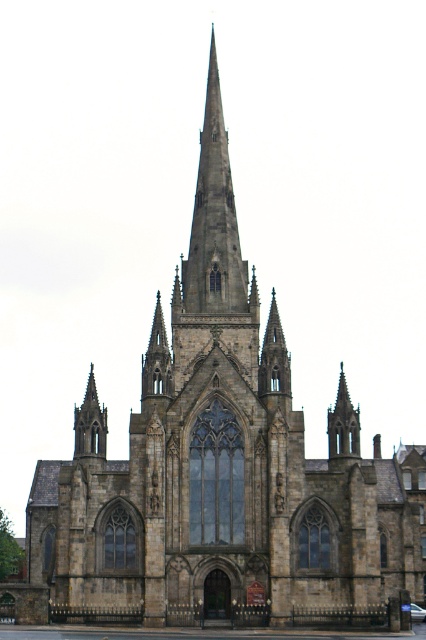
Consider the image. You are standing in front of the church and want to take a photo that captures both the brown stone spire at lower left and the dark brown stone spire at upper center. Which spire should you focus on first to ensure both are in frame?

The brown stone spire at lower left is much taller than the dark brown stone spire at upper center, so focusing on the taller one first will help ensure both are in frame.